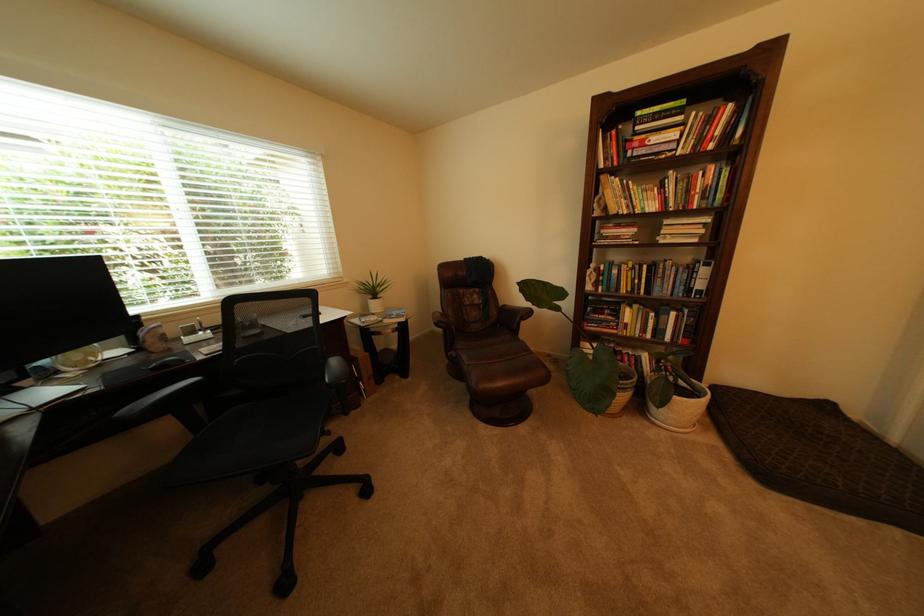
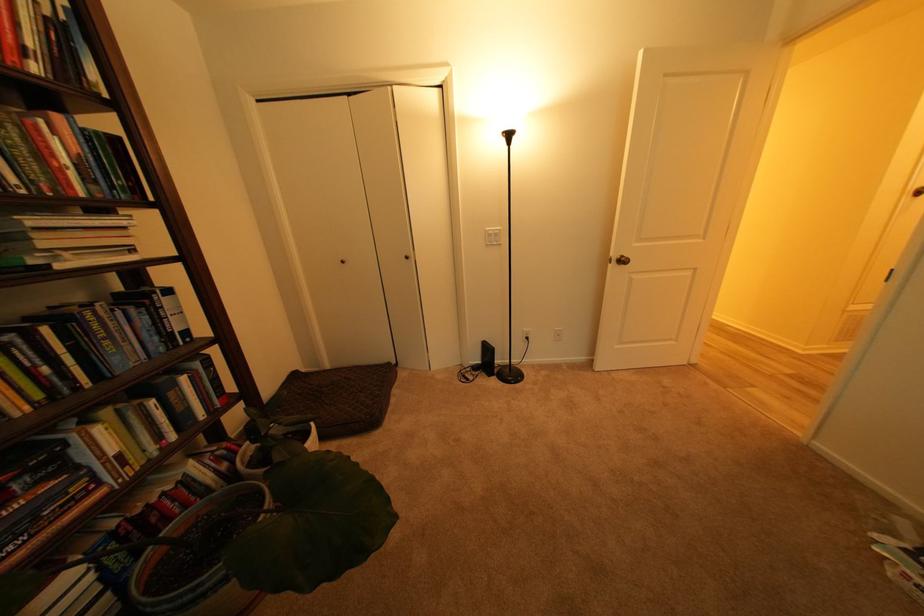
Find the pixel in the second image that matches point (716, 187) in the first image.

(84, 156)